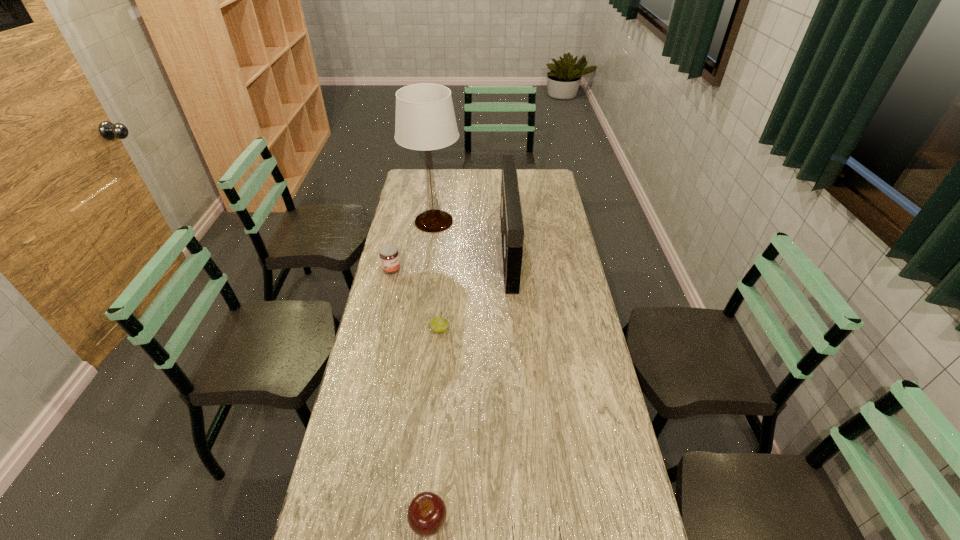
Locate an element on the screen. This screenshot has height=540, width=960. table lamp positioned at the left edge is located at coordinates pyautogui.click(x=425, y=120).

I want to click on jam situated at the left edge, so click(x=389, y=256).

The height and width of the screenshot is (540, 960). In the image, there is a desktop. What are the coordinates of `blank space at the far edge` in the screenshot? It's located at (463, 180).

This screenshot has height=540, width=960. What are the coordinates of `free space at the left edge` in the screenshot? It's located at (360, 520).

In the image, there is a desktop. Identify the location of vacant space at the right edge. (596, 421).

Where is `free space at the far right corner of the desktop`? This screenshot has height=540, width=960. free space at the far right corner of the desktop is located at coordinates (544, 180).

Locate an element on the screen. free space that is in between the tallest object and the jam is located at coordinates (413, 246).

The height and width of the screenshot is (540, 960). I want to click on empty space between the videotape and the tallest object, so click(471, 236).

Find the location of `empty space that is in between the videotape and the jam`. empty space that is in between the videotape and the jam is located at coordinates (450, 260).

Where is `empty space between the tallest object and the jam`? The height and width of the screenshot is (540, 960). empty space between the tallest object and the jam is located at coordinates (413, 246).